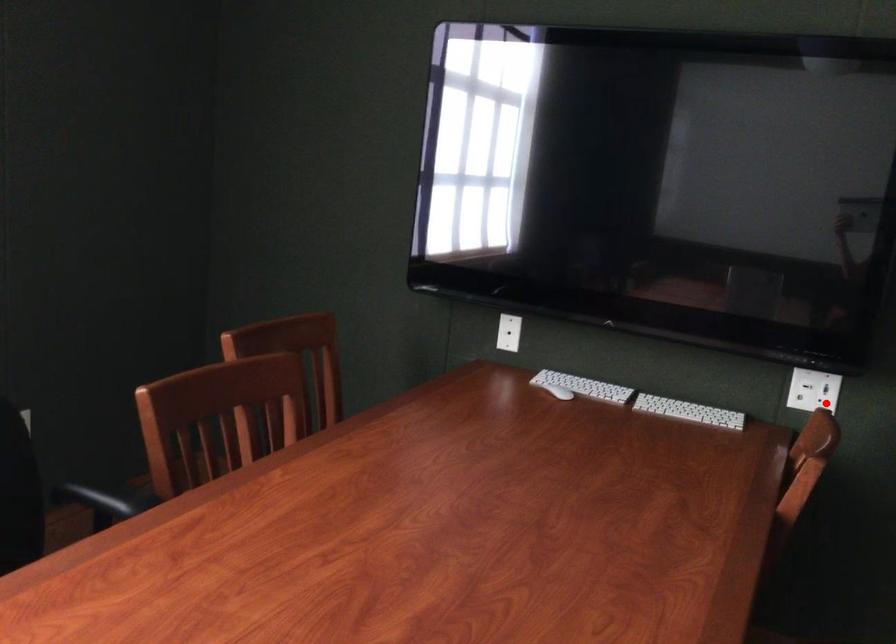
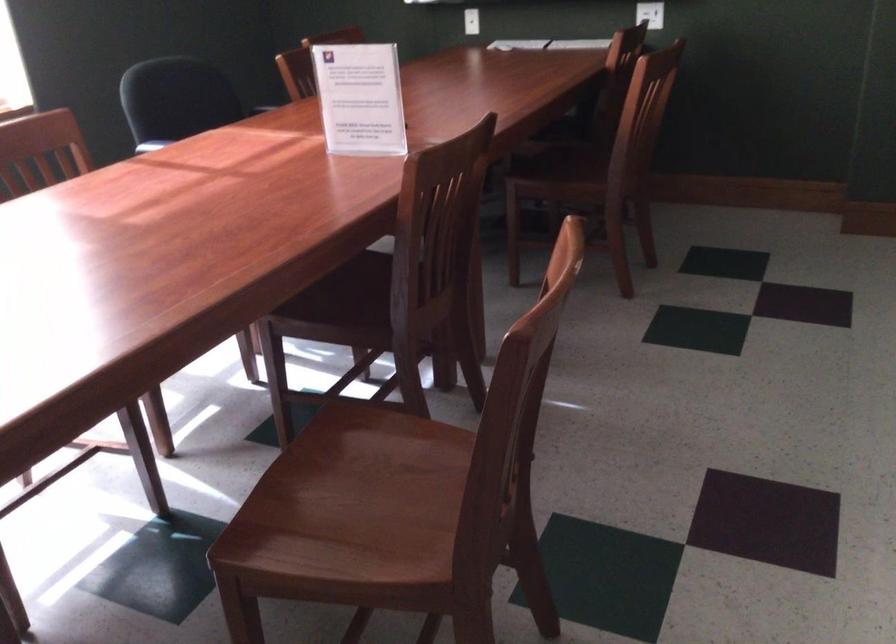
Where in the second image is the point corresponding to the highlighted location from the first image?

(650, 14)